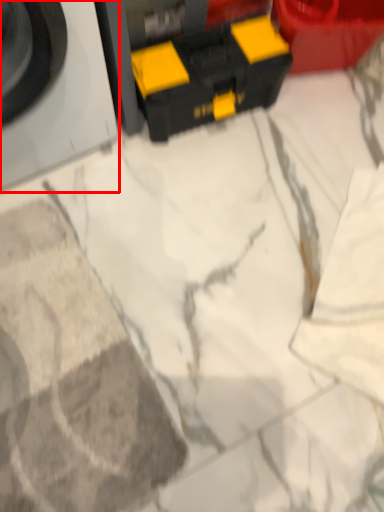
Question: Where is washing machine (annotated by the red box) located in relation to toy in the image?

Choices:
 (A) left
 (B) right

Answer: (A)